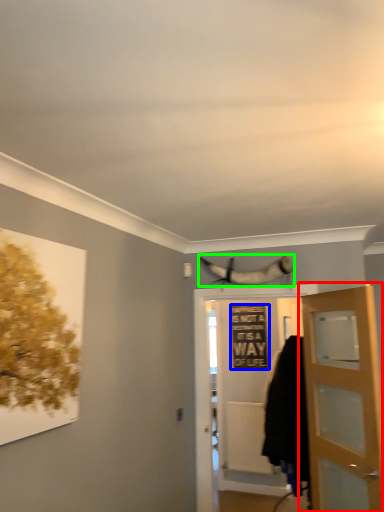
Question: Estimate the real-world distances between objects in this image. Which object is farther from door (highlighted by a red box), picture frame (highlighted by a blue box) or animal (highlighted by a green box)?

Choices:
 (A) picture frame
 (B) animal

Answer: (A)